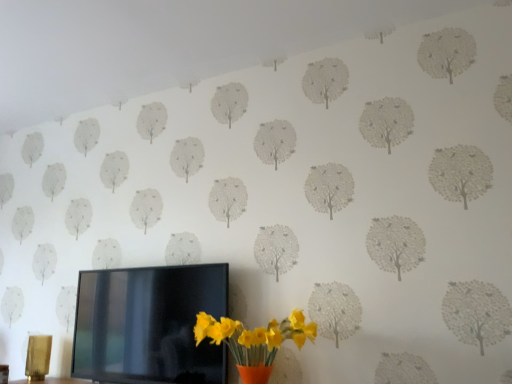
Measure the distance between black glossy tv at center and camera.

1.84 meters.

The height and width of the screenshot is (384, 512). Describe the element at coordinates (149, 324) in the screenshot. I see `black glossy tv at center` at that location.

Locate an element on the screen. This screenshot has height=384, width=512. black glossy tv at center is located at coordinates (149, 324).

Measure the distance between point (x=170, y=320) and camera.

The distance of point (x=170, y=320) from camera is 2.02 meters.

You are a GUI agent. You are given a task and a screenshot of the screen. Output one action in this format:
    pyautogui.click(x=<x>, y=<y>)
    Task: Click on the black glossy tv at center
    The image size is (512, 384).
    Given the screenshot: What is the action you would take?
    pyautogui.click(x=149, y=324)